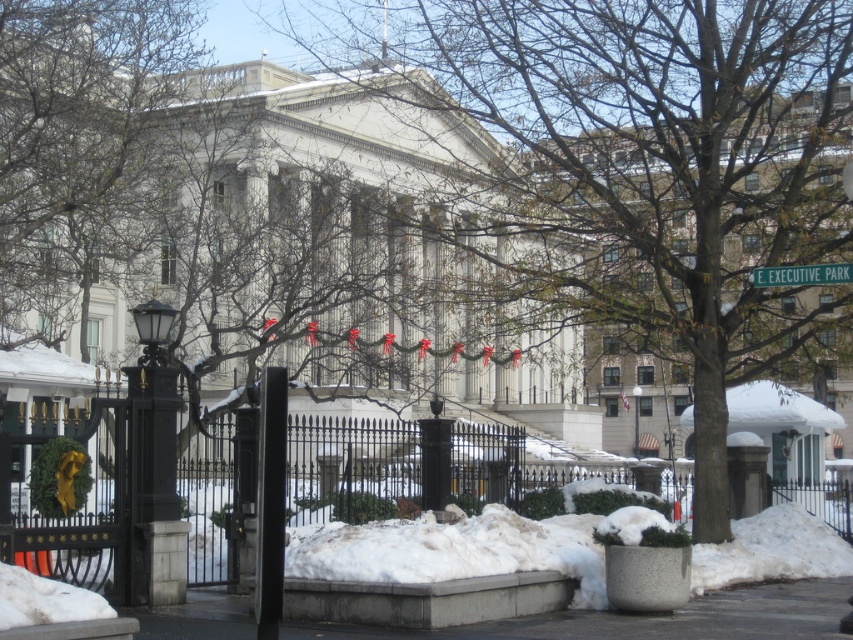
Can you confirm if brown leafless tree at upper center is smaller than black glossy pole at center?

No.

In the scene shown: Who is positioned more to the right, brown leafless tree at upper center or black glossy pole at center?

black glossy pole at center

This screenshot has width=853, height=640. What do you see at coordinates (77, 102) in the screenshot?
I see `brown leafless tree at upper center` at bounding box center [77, 102].

This screenshot has height=640, width=853. I want to click on brown leafless tree at upper center, so [77, 102].

Which is above, brown leafless tree at upper center or gray concrete pavement at lower center?

brown leafless tree at upper center

Describe the element at coordinates (77, 102) in the screenshot. Image resolution: width=853 pixels, height=640 pixels. I see `brown leafless tree at upper center` at that location.

Is point (56, 164) less distant than point (645, 616)?

No, (56, 164) is further to viewer.

This screenshot has width=853, height=640. In order to click on brown leafless tree at upper center in this screenshot , I will do `click(77, 102)`.

Is black glossy pole at center smaller than green plastic street sign at upper right?

Incorrect, black glossy pole at center is not smaller in size than green plastic street sign at upper right.

Can you confirm if black glossy pole at center is wider than green plastic street sign at upper right?

No, black glossy pole at center is not wider than green plastic street sign at upper right.

Between point (277, 397) and point (842, 262), which one is positioned behind?

Point (842, 262)

Find the location of a particular element. The height and width of the screenshot is (640, 853). black glossy pole at center is located at coordinates click(x=270, y=500).